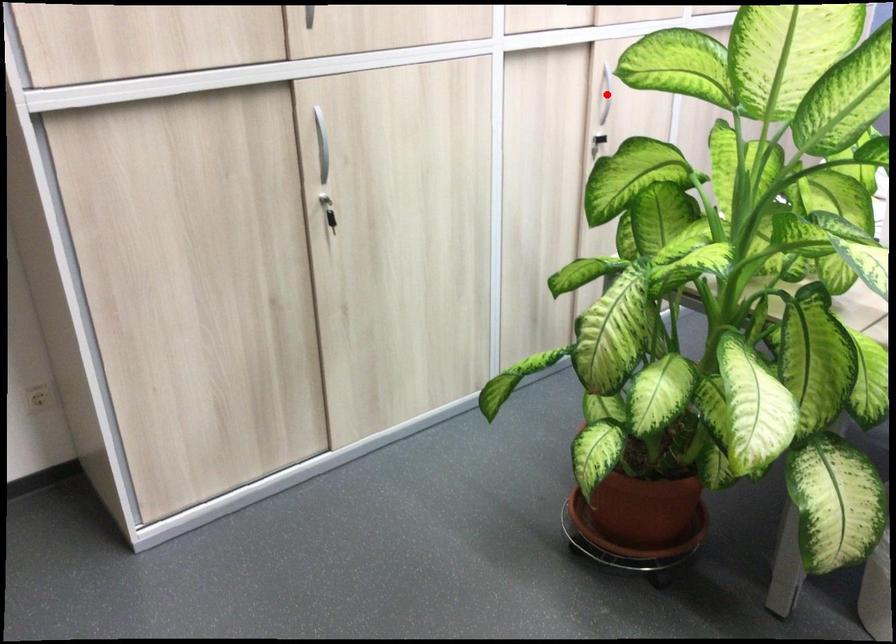
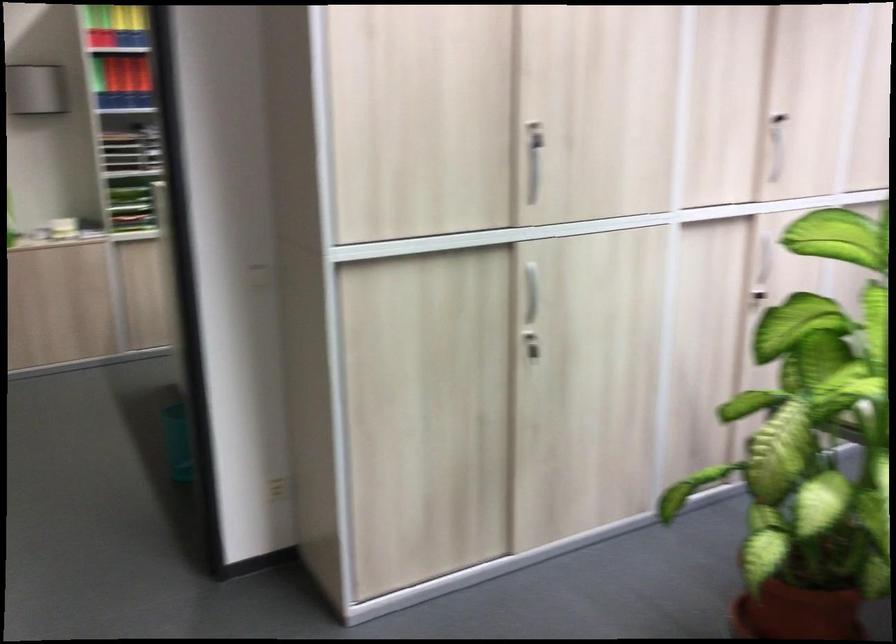
Question: A red point is marked in image1. In image2, is the corresponding 3D point closer to the camera or farther? Reply with the corresponding letter.

Choices:
 (A) The corresponding 3D point is closer.
 (B) The corresponding 3D point is farther.

Answer: (B)